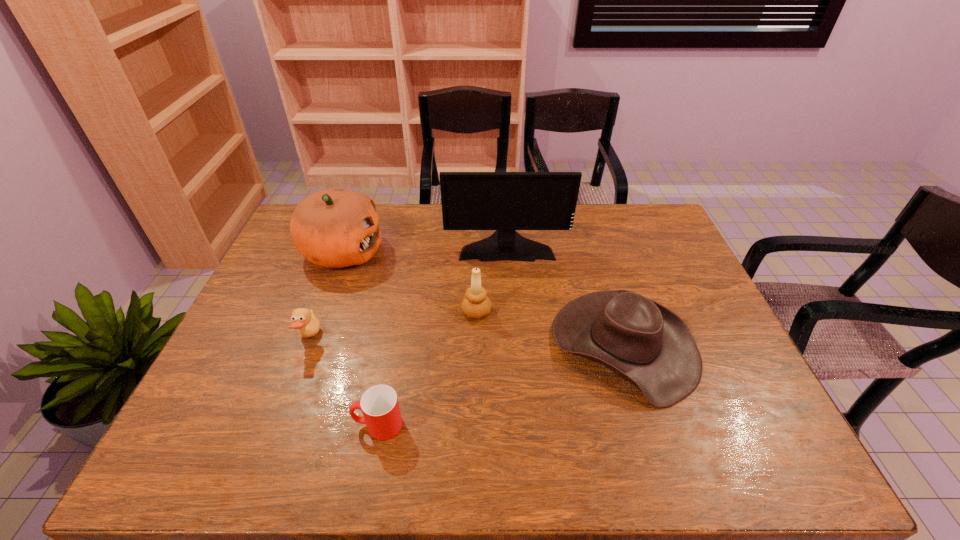
Locate an element on the screen. The height and width of the screenshot is (540, 960). free space between the monitor and the cowboy hat is located at coordinates (565, 295).

Find the location of a particular element. The width and height of the screenshot is (960, 540). free space between the cowboy hat and the cup is located at coordinates (501, 385).

The image size is (960, 540). I want to click on free spot between the cup and the duck, so (x=344, y=381).

The height and width of the screenshot is (540, 960). I want to click on vacant space that is in between the cup and the cowboy hat, so click(501, 385).

Locate which object ranks in proximity to the second tallest object. Please provide its 2D coordinates. Your answer should be formatted as a tuple, i.e. [(x, y)], where the tuple contains the x and y coordinates of a point satisfying the conditions above.

[(304, 320)]

Select which object is the second closest to the cowboy hat. Please provide its 2D coordinates. Your answer should be formatted as a tuple, i.e. [(x, y)], where the tuple contains the x and y coordinates of a point satisfying the conditions above.

[(475, 304)]

The image size is (960, 540). What are the coordinates of `vacant space that satisfies the following two spatial constraints: 1. on the side of the third tallest object with the handle; 2. on the right side of the nearest object` in the screenshot? It's located at (399, 312).

The image size is (960, 540). In order to click on free space that satisfies the following two spatial constraints: 1. on the screen side of the tallest object; 2. on the beak of the duck in this screenshot , I will do (x=514, y=338).

Locate an element on the screen. vacant area that satisfies the following two spatial constraints: 1. on the screen side of the tallest object; 2. on the face of the pumpkin is located at coordinates (507, 252).

Identify the location of vacant region that satisfies the following two spatial constraints: 1. on the screen side of the cowboy hat; 2. on the left side of the monitor. (514, 346).